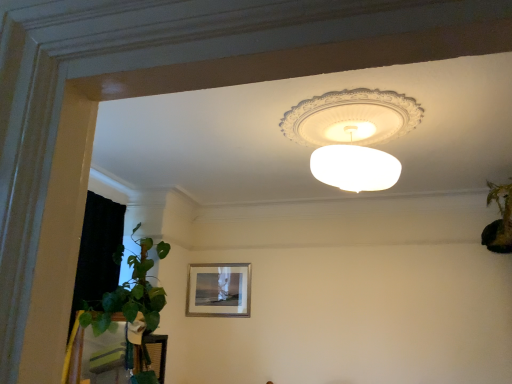
Question: Does green leafy plant at right have a greater width compared to matte silver picture frame at center?

Choices:
 (A) no
 (B) yes

Answer: (B)

Question: Is green leafy plant at right beside matte silver picture frame at center?

Choices:
 (A) no
 (B) yes

Answer: (A)

Question: Is green leafy plant at right positioned with its back to matte silver picture frame at center?

Choices:
 (A) no
 (B) yes

Answer: (A)

Question: Does green leafy plant at right turn towards matte silver picture frame at center?

Choices:
 (A) no
 (B) yes

Answer: (A)

Question: Is green leafy plant at right completely or partially outside of matte silver picture frame at center?

Choices:
 (A) no
 (B) yes

Answer: (B)

Question: Is point (330, 163) positioned closer to the camera than point (502, 200)?

Choices:
 (A) closer
 (B) farther

Answer: (A)

Question: Is white frosted glass lampshade at upper center wider or thinner than green leafy plant at right?

Choices:
 (A) wide
 (B) thin

Answer: (A)

Question: From a real-world perspective, is white frosted glass lampshade at upper center positioned above or below green leafy plant at right?

Choices:
 (A) below
 (B) above

Answer: (B)

Question: Is white frosted glass lampshade at upper center taller or shorter than green leafy plant at right?

Choices:
 (A) short
 (B) tall

Answer: (A)

Question: Based on their positions, is green leafy plant at right located to the left or right of matte silver picture frame at center?

Choices:
 (A) right
 (B) left

Answer: (A)

Question: Is green leafy plant at right wider or thinner than matte silver picture frame at center?

Choices:
 (A) wide
 (B) thin

Answer: (A)

Question: Is green leafy plant at right bigger or smaller than matte silver picture frame at center?

Choices:
 (A) big
 (B) small

Answer: (A)

Question: Does point (509, 235) appear closer or farther from the camera than point (225, 266)?

Choices:
 (A) closer
 (B) farther

Answer: (A)

Question: Choose the correct answer: Is green leafy plant at right inside white frosted glass lampshade at upper center or outside it?

Choices:
 (A) inside
 (B) outside

Answer: (B)

Question: Is green leafy plant at right in front of or behind white frosted glass lampshade at upper center in the image?

Choices:
 (A) front
 (B) behind

Answer: (B)